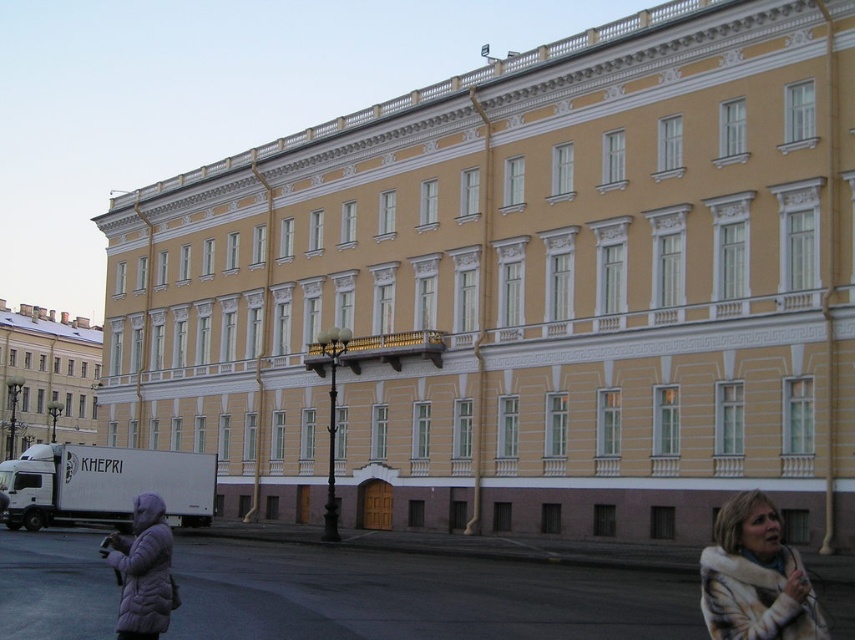
Between fur coat at lower right and yellow painted building at upper left, which one has less height?

With less height is fur coat at lower right.

Does fur coat at lower right have a lesser width compared to yellow painted building at upper left?

Yes, fur coat at lower right is thinner than yellow painted building at upper left.

Does point (782, 602) come closer to viewer compared to point (57, 387)?

Yes, point (782, 602) is in front of point (57, 387).

I want to click on fur coat at lower right, so click(755, 577).

Does yellow painted building at upper left have a greater width compared to purple fuzzy coat at lower left?

Yes.

Is yellow painted building at upper left bigger than purple fuzzy coat at lower left?

Yes.

Does point (74, 404) come behind point (167, 554)?

Yes.

Image resolution: width=855 pixels, height=640 pixels. Find the location of `yellow painted building at upper left`. yellow painted building at upper left is located at coordinates (46, 374).

How much distance is there between fur coat at lower right and purple fuzzy coat at lower left?

A distance of 49.99 feet exists between fur coat at lower right and purple fuzzy coat at lower left.

Can you confirm if fur coat at lower right is shorter than purple fuzzy coat at lower left?

Incorrect, fur coat at lower right's height does not fall short of purple fuzzy coat at lower left's.

Is point (799, 605) farther from viewer compared to point (110, 547)?

No, (799, 605) is closer to viewer.

Where is `fur coat at lower right`? This screenshot has width=855, height=640. fur coat at lower right is located at coordinates (755, 577).